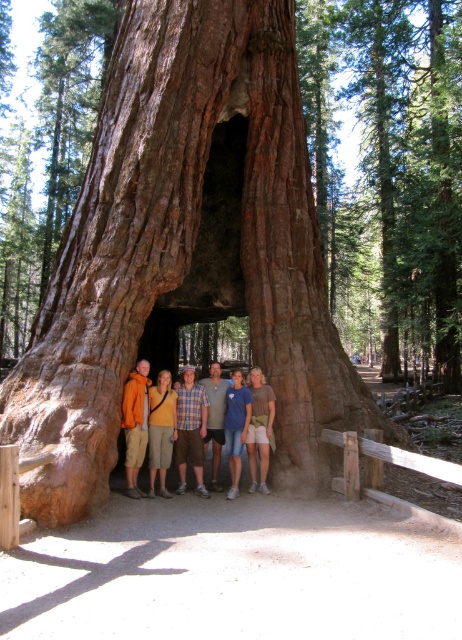
You are standing outside the hollowed tree trunk and want to see the matte orange jacket at center inside. Can you see it from your current position?

The matte orange jacket at center is 6.50 meters away from viewer, so yes, you can see it from your current position as it is within visible range.

You are a hiker who wants to take a photo of the brown rough tree trunk at center and the matte orange jacket at center. Which object should you focus on first if you want to capture both in a single frame without moving the camera?

You should focus on the matte orange jacket at center first because the brown rough tree trunk at center is shorter than the matte orange jacket at center, so adjusting focus from the shorter to taller object will ensure both are in frame.